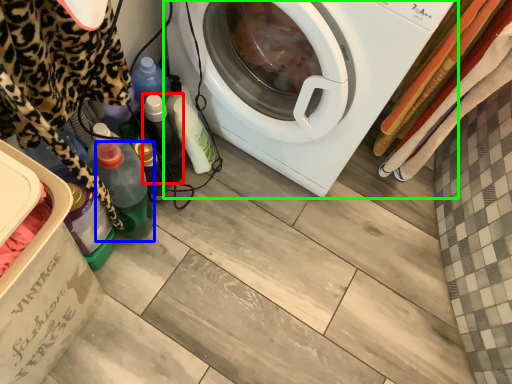
Question: Which object is the closest to the bottle (highlighted by a red box)? Choose among these: bottle (highlighted by a blue box) or washing machine (highlighted by a green box).

Choices:
 (A) bottle
 (B) washing machine

Answer: (A)